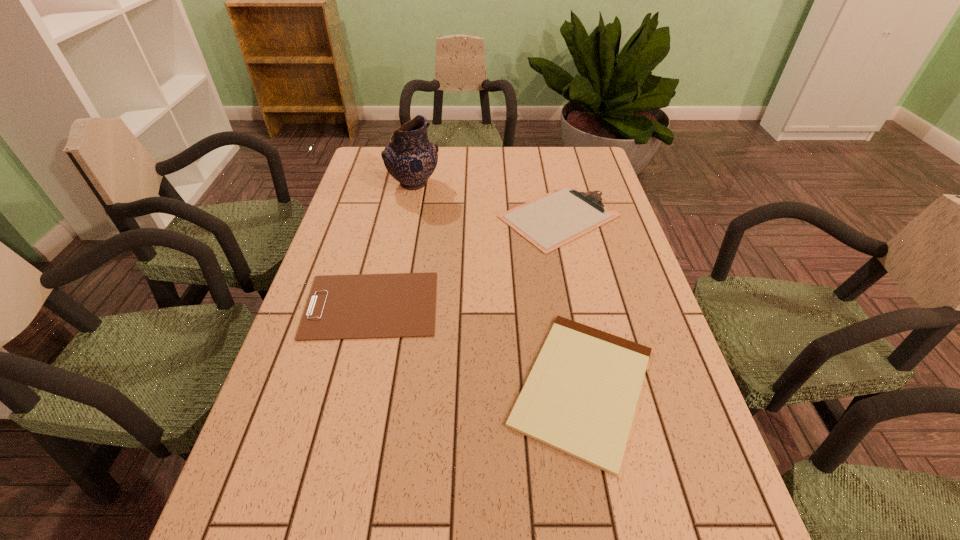
Where is `clipboard that stands as the closest to the tallest clipboard`? clipboard that stands as the closest to the tallest clipboard is located at coordinates (366, 306).

Choose which clipboard is the nearest neighbor to the pottery. Please provide its 2D coordinates. Your answer should be formatted as a tuple, i.e. [(x, y)], where the tuple contains the x and y coordinates of a point satisfying the conditions above.

[(550, 221)]

Where is `vacant area that satisfies the following two spatial constraints: 1. on the back side of the tallest clipboard; 2. on the left side of the leftmost clipboard`? vacant area that satisfies the following two spatial constraints: 1. on the back side of the tallest clipboard; 2. on the left side of the leftmost clipboard is located at coordinates (393, 216).